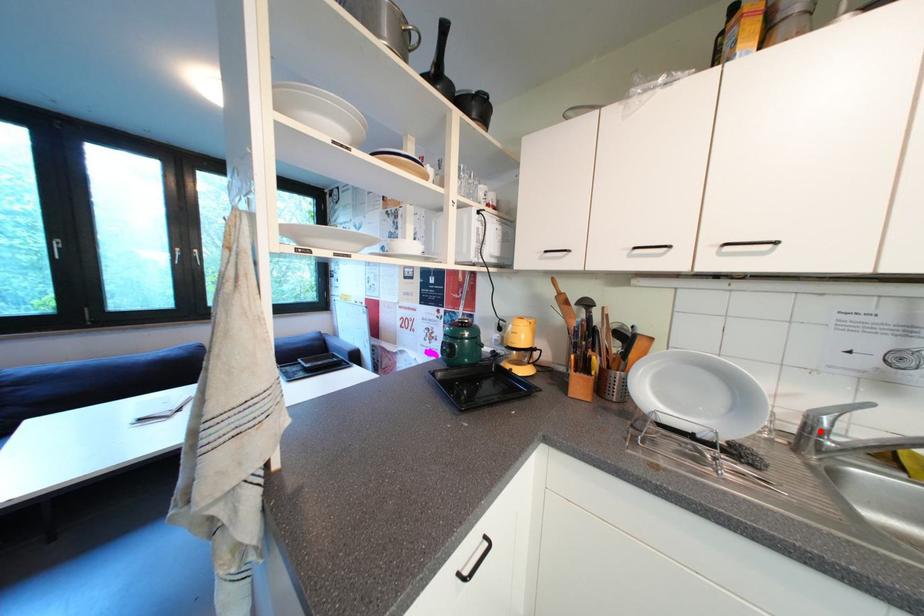
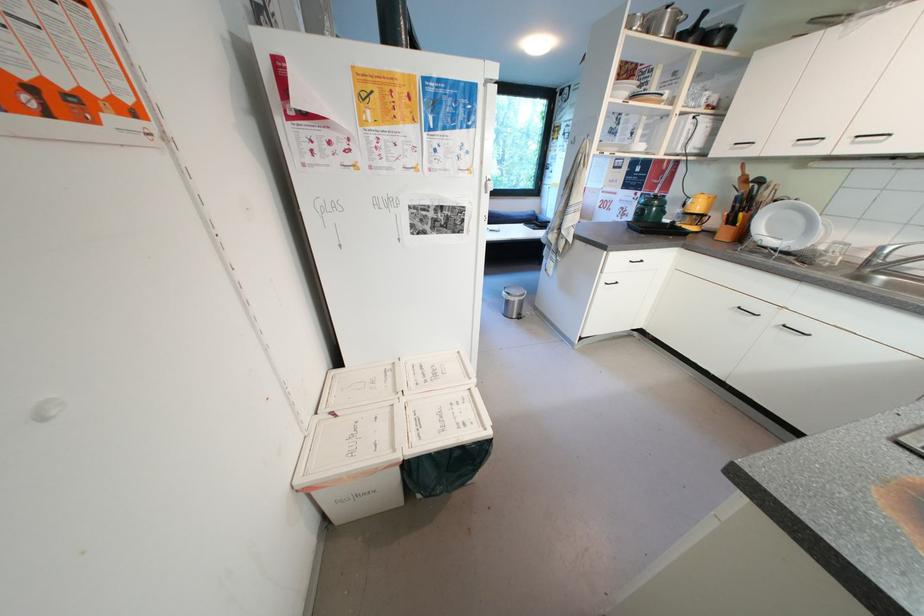
Question: I am providing you with two images of the same scene from different viewpoints. Image1 has a red point marked. In image2, the corresponding 3D location appears at what relative position? Reply with the corresponding letter.

Choices:
 (A) Closer
 (B) Farther

Answer: (B)